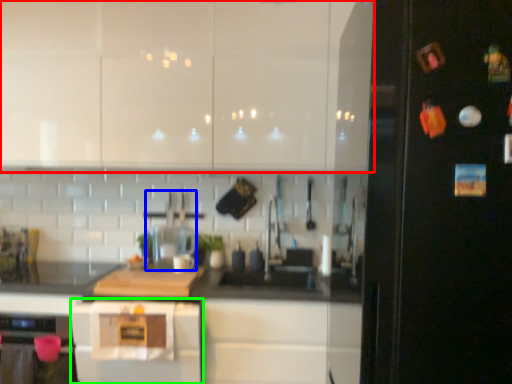
Question: Based on their relative distances, which object is nearer to cabinetry (highlighted by a red box)? Choose from appliance (highlighted by a blue box) and home appliance (highlighted by a green box).

Choices:
 (A) appliance
 (B) home appliance

Answer: (A)